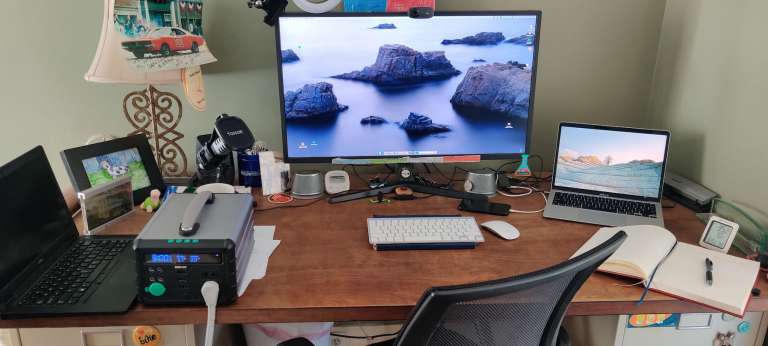
Where is `black open laptop`? black open laptop is located at coordinates (44, 260).